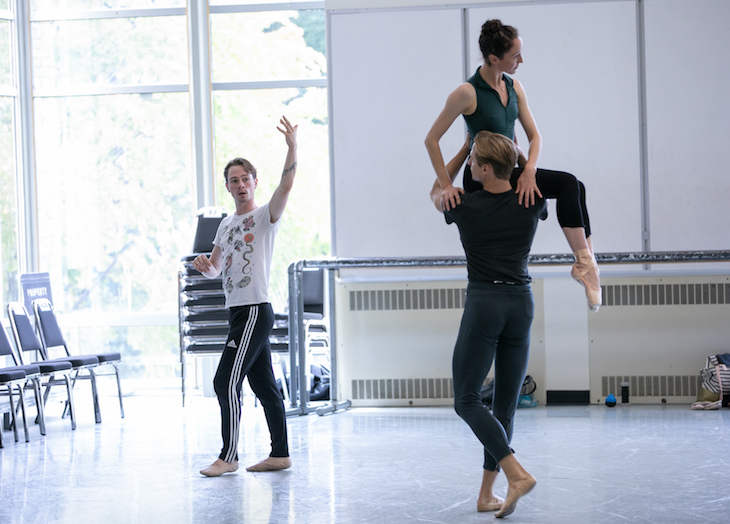
You are a GUI agent. You are given a task and a screenshot of the screen. Output one action in this format:
    pyautogui.click(x=<x>, y=<y>)
    Task: Click on the wall panels
    Image resolution: width=730 pixels, height=524 pixels.
    Given the screenshot: What is the action you would take?
    pyautogui.click(x=377, y=115), pyautogui.click(x=607, y=75), pyautogui.click(x=669, y=83)